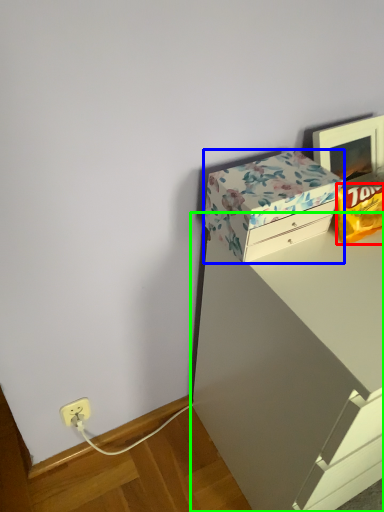
Question: Which object is positioned closest to wrapping paper (highlighted by a red box)? Select from box (highlighted by a blue box) and vanity (highlighted by a green box).

Choices:
 (A) box
 (B) vanity

Answer: (A)